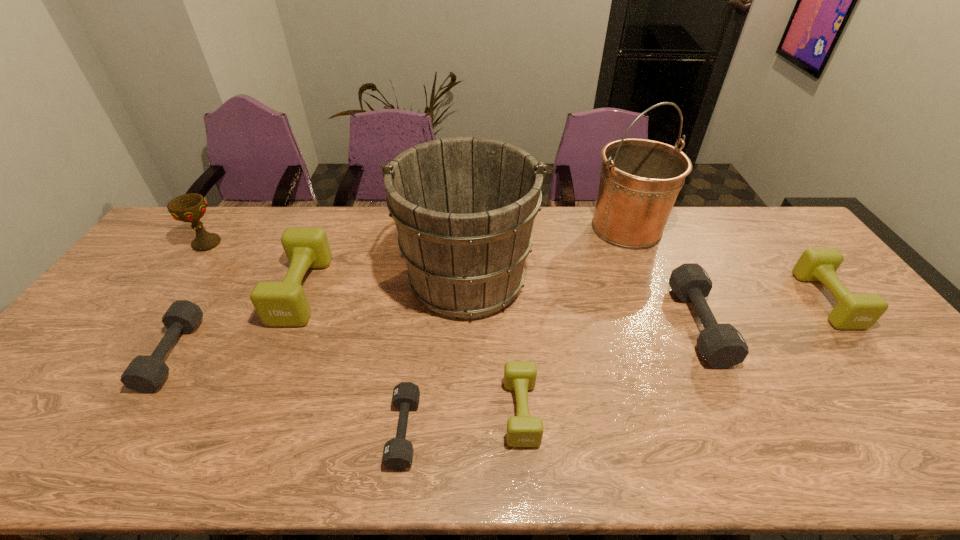
Locate an element on the screen. vacant space that satisfies the following two spatial constraints: 1. on the back side of the right bucket; 2. on the left side of the sixth shortest object is located at coordinates (327, 228).

Find the location of a particular element. This screenshot has height=540, width=960. free location that satisfies the following two spatial constraints: 1. on the back side of the smallest gray dumbbell; 2. on the right side of the right bucket is located at coordinates (431, 228).

Identify the location of vacant position in the image that satisfies the following two spatial constraints: 1. on the back side of the right bucket; 2. on the right side of the sixth shortest object. (327, 228).

Where is `free space that satisfies the following two spatial constraints: 1. on the front side of the biggest gray dumbbell; 2. on the right side of the chalice`? This screenshot has width=960, height=540. free space that satisfies the following two spatial constraints: 1. on the front side of the biggest gray dumbbell; 2. on the right side of the chalice is located at coordinates (149, 325).

The width and height of the screenshot is (960, 540). I want to click on vacant space that satisfies the following two spatial constraints: 1. on the front side of the biggest gray dumbbell; 2. on the left side of the leftmost olive dumbbell, so click(x=287, y=325).

Find the location of a particular element. vacant space that satisfies the following two spatial constraints: 1. on the front side of the right bucket; 2. on the right side of the second smallest olive dumbbell is located at coordinates (656, 300).